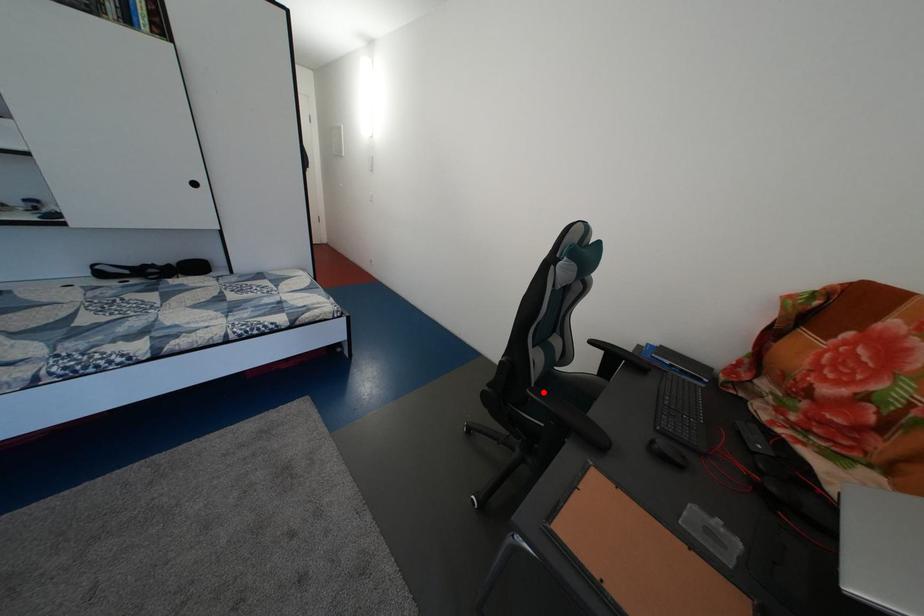
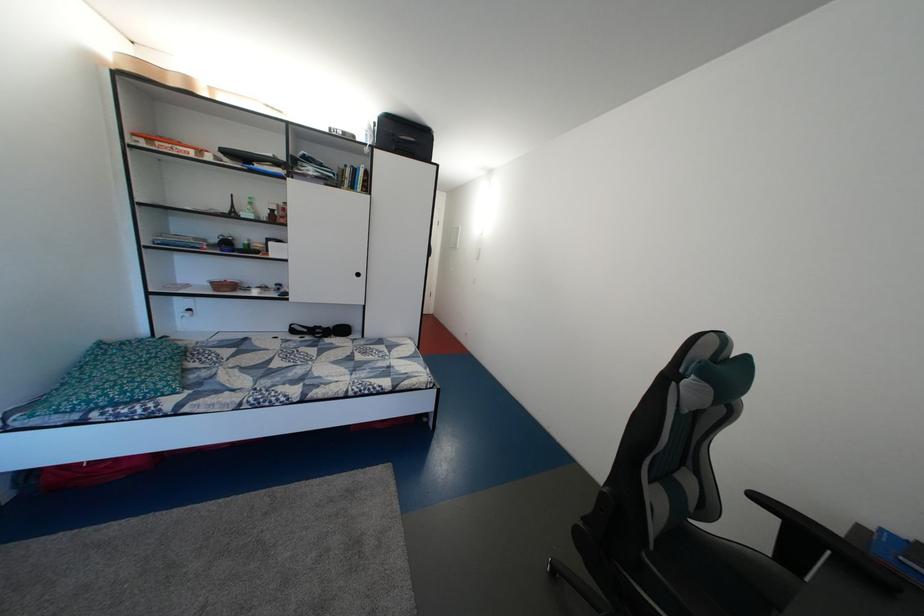
The point at the highlighted location is marked in the first image. Where is the corresponding point in the second image?

(662, 554)